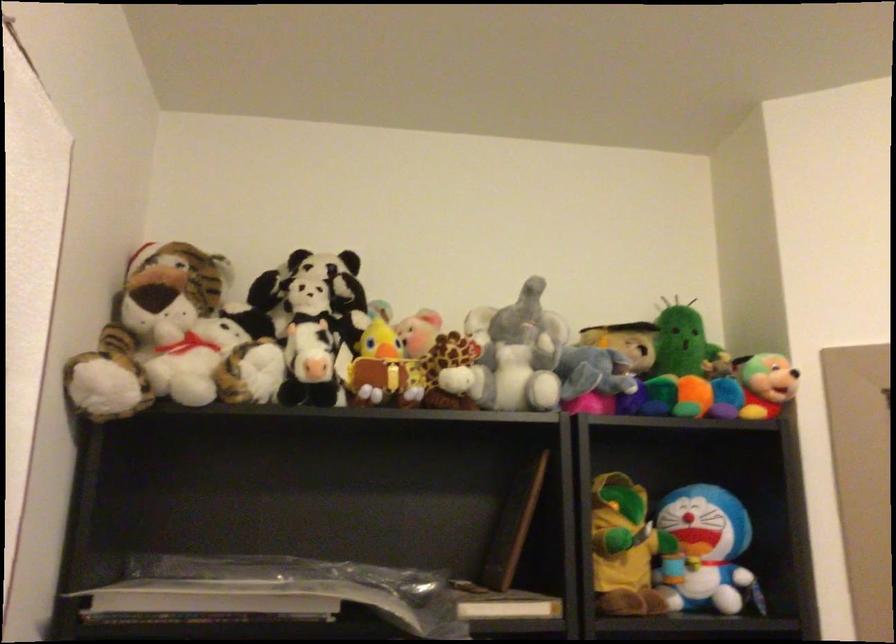
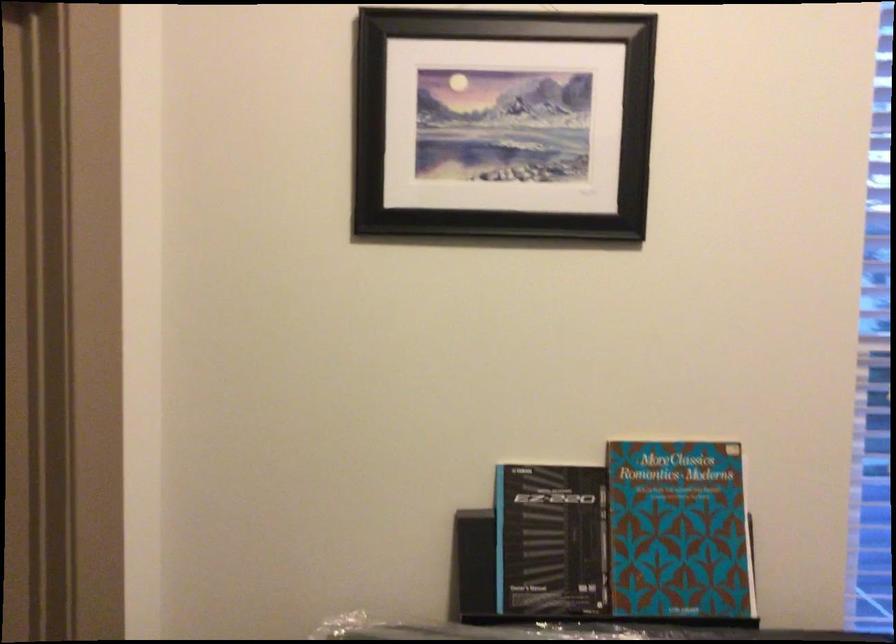
Question: The images are taken continuously from a first-person perspective. In which direction is your viewpoint rotating?

Choices:
 (A) Left
 (B) Right
 (C) Up
 (D) Down

Answer: (B)